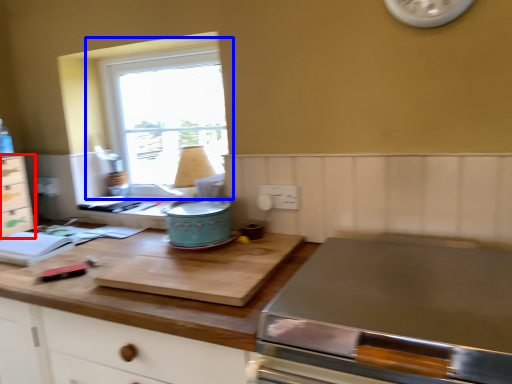
Question: Which object appears farthest to the camera in this image, cabinetry (highlighted by a red box) or window (highlighted by a blue box)?

Choices:
 (A) cabinetry
 (B) window

Answer: (A)